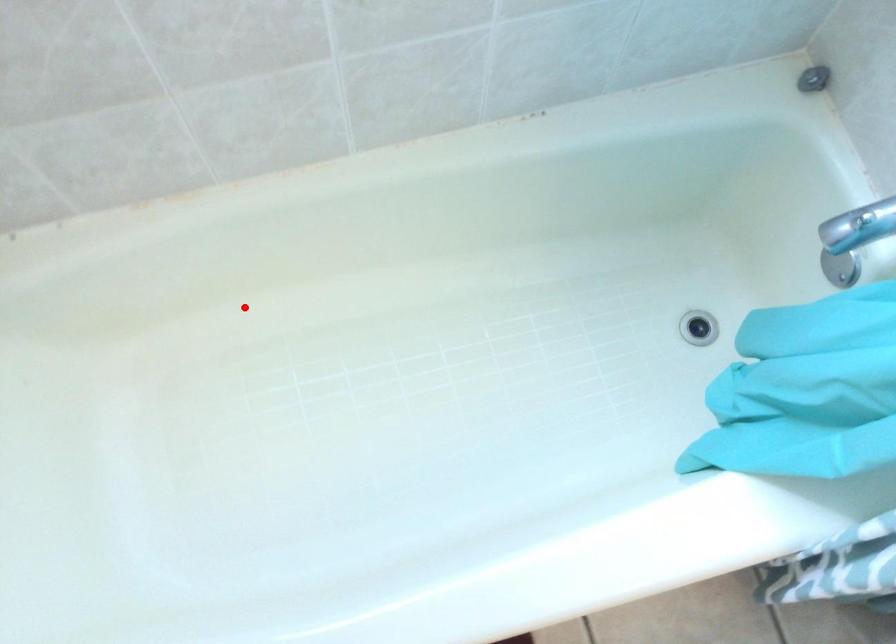
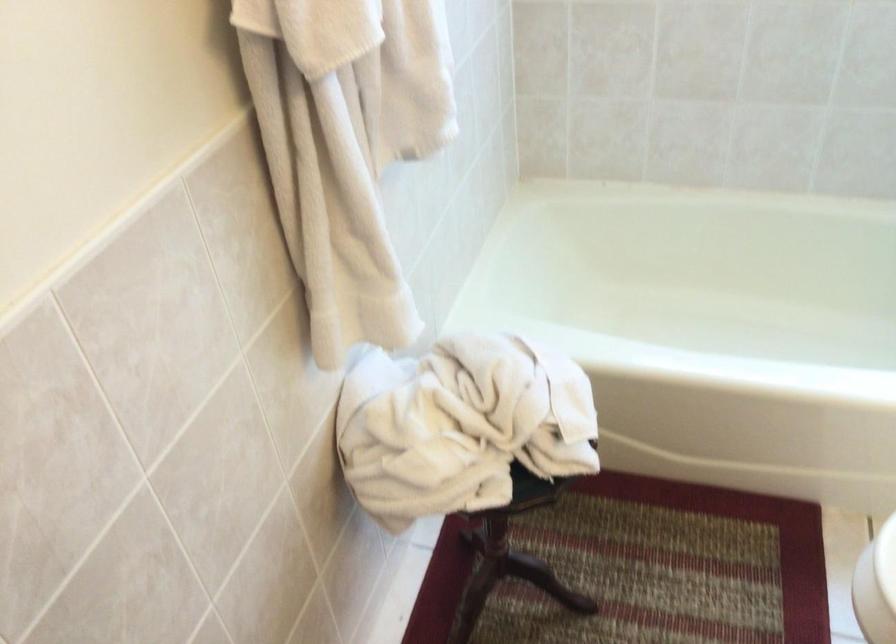
Question: A red point is marked in image1. In image2, is the corresponding 3D point closer to the camera or farther? Reply with the corresponding letter.

Choices:
 (A) The corresponding 3D point is closer.
 (B) The corresponding 3D point is farther.

Answer: (B)